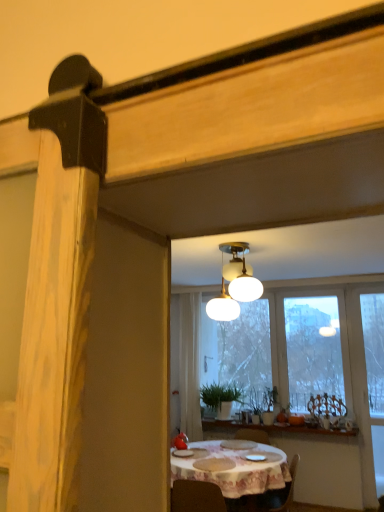
Question: Considering the positions of green matte plant at center and white cloth-covered table at center in the image, is green matte plant at center wider or thinner than white cloth-covered table at center?

Choices:
 (A) thin
 (B) wide

Answer: (A)

Question: Is point (216, 407) closer or farther from the camera than point (243, 488)?

Choices:
 (A) closer
 (B) farther

Answer: (B)

Question: Which object is the farthest from the green matte plant at center?

Choices:
 (A) white ceramic window sill at center
 (B) transparent glass window at center
 (C) white cloth-covered table at center
 (D) white frosted glass lamp at upper center
 (E) white sheer curtain at center

Answer: (D)

Question: Which object is positioned farthest from the white frosted glass lamp at upper center?

Choices:
 (A) green matte plant at center
 (B) white ceramic window sill at center
 (C) white sheer curtain at center
 (D) transparent glass window at center
 (E) white cloth-covered table at center

Answer: (A)